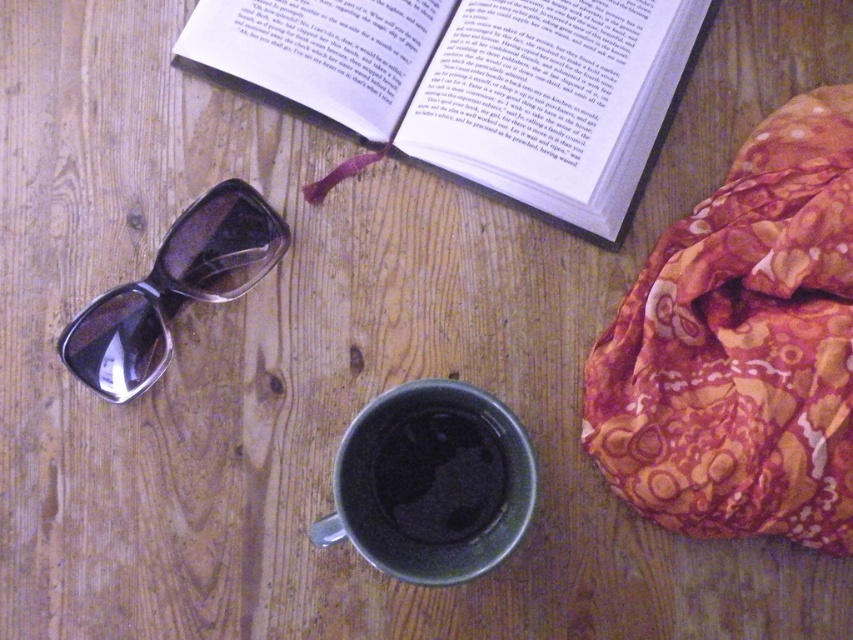
Question: Does smokey gray plastic glasses at lower left appear over black matte mug at center?

Choices:
 (A) no
 (B) yes

Answer: (B)

Question: Among these points, which one is farthest from the camera?

Choices:
 (A) (422, 524)
 (B) (465, 412)
 (C) (492, 140)

Answer: (C)

Question: Is the position of floral silk scarf at upper right more distant than that of matte ceramic mug at center?

Choices:
 (A) yes
 (B) no

Answer: (A)

Question: Can you confirm if hardcover book at upper center is thinner than black matte mug at center?

Choices:
 (A) yes
 (B) no

Answer: (B)

Question: Estimate the real-world distances between objects in this image. Which object is closer to the floral silk scarf at upper right?

Choices:
 (A) matte ceramic mug at center
 (B) black matte mug at center
 (C) hardcover book at upper center
 (D) smokey gray plastic glasses at lower left

Answer: (A)

Question: Estimate the real-world distances between objects in this image. Which object is farther from the black matte mug at center?

Choices:
 (A) smokey gray plastic glasses at lower left
 (B) hardcover book at upper center
 (C) matte ceramic mug at center

Answer: (B)